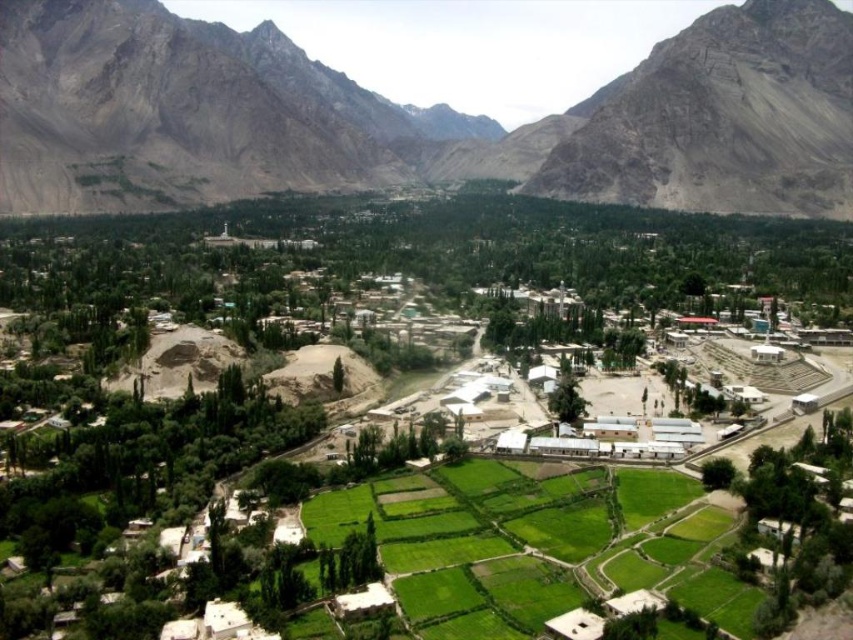
You are an architect planning to build a hiking trail that connects the rugged stone mountain range at center and the brown rocky mountain at upper left. Considering their sizes, which mountain will require a more extensive trail system to accommodate its size?

The rugged stone mountain range at center requires a more extensive trail system because it is bigger than the brown rocky mountain at upper left.

Based on the scene description, what does the point at coordinates (412, 116) represent?

The point at coordinates (412, 116) represents the rugged stone mountain range at center.